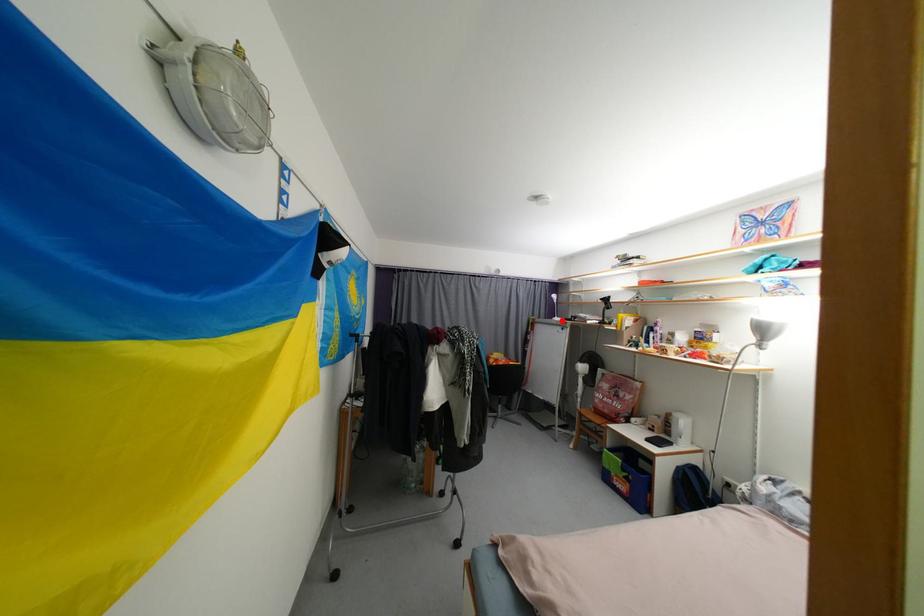
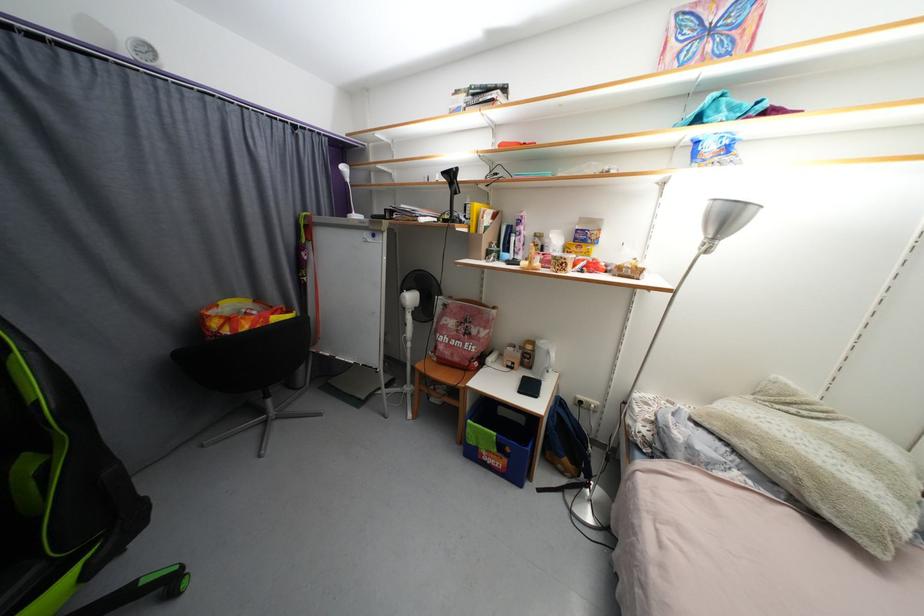
Question: I am providing you with two images of the same scene from different viewpoints. Given a red point in image1, look at the same physical point in image2. Is it:

Choices:
 (A) Closer to the viewpoint
 (B) Farther from the viewpoint

Answer: (A)